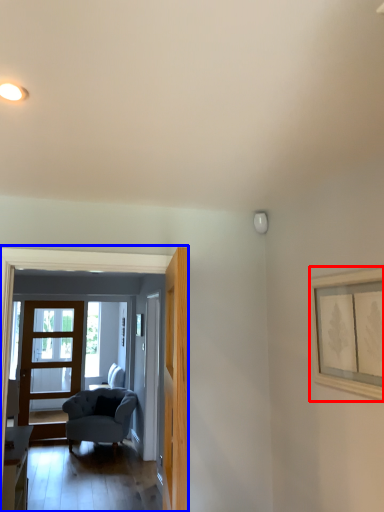
Question: Which object is further to the camera taking this photo, picture frame (highlighted by a red box) or residence (highlighted by a blue box)?

Choices:
 (A) picture frame
 (B) residence

Answer: (B)